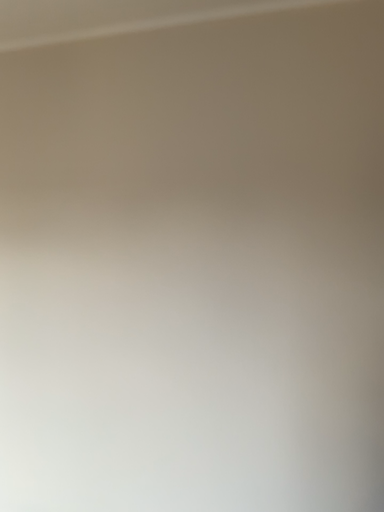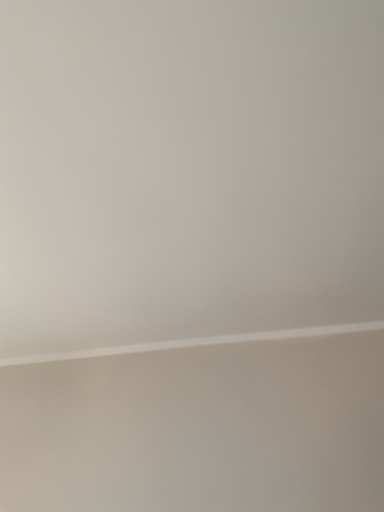
Question: Which way did the camera rotate in the video?

Choices:
 (A) rotated downward
 (B) rotated upward

Answer: (B)